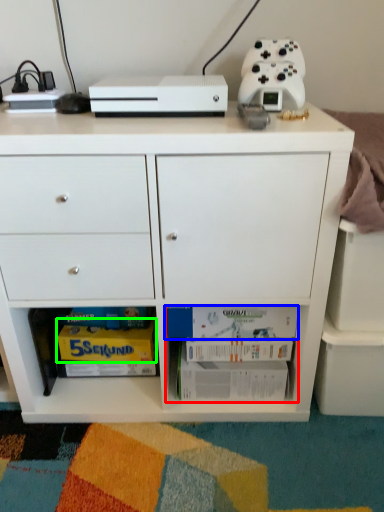
Question: Which object is positioned farthest from book (highlighted by a red box)? Select from book (highlighted by a blue box) and magazine (highlighted by a green box).

Choices:
 (A) book
 (B) magazine

Answer: (B)